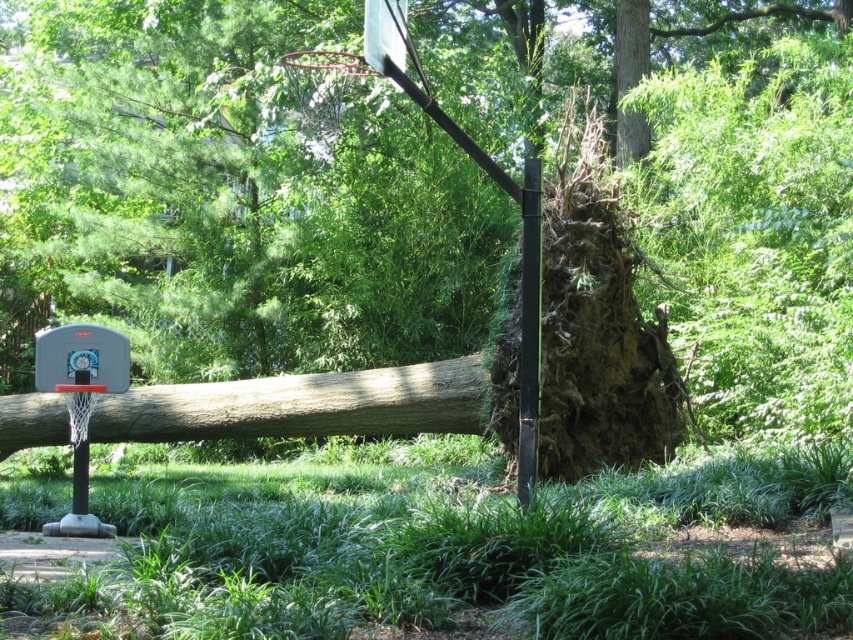
Does brown rough tree trunk at center appear under matte gray basketball hoop at left?

Yes, brown rough tree trunk at center is below matte gray basketball hoop at left.

Is brown rough tree trunk at center further to the viewer compared to matte gray basketball hoop at left?

Yes, brown rough tree trunk at center is behind matte gray basketball hoop at left.

In the scene shown: Who is more distant from viewer, (x=259, y=429) or (x=78, y=378)?

The point (x=259, y=429) is more distant.

This screenshot has height=640, width=853. I want to click on brown rough tree trunk at center, so click(302, 404).